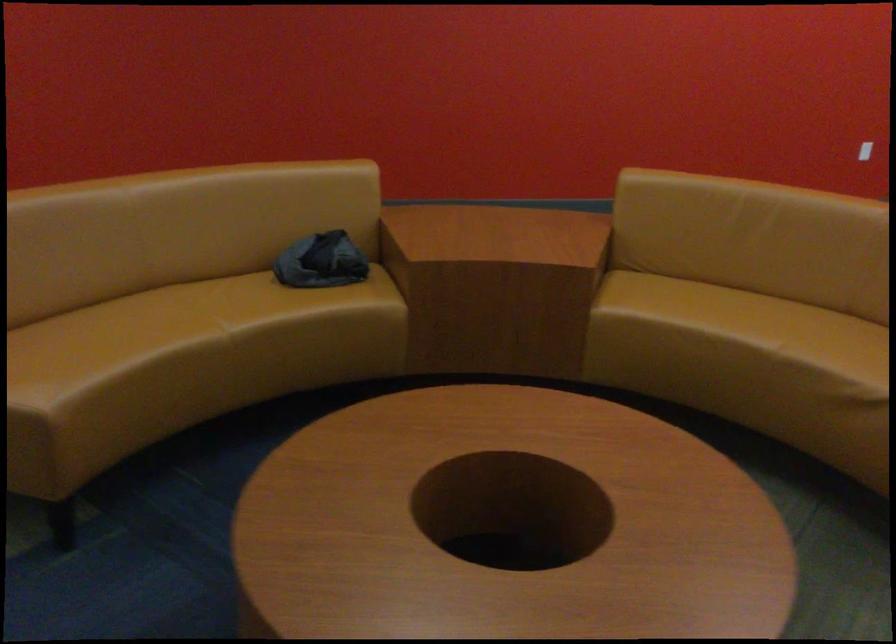
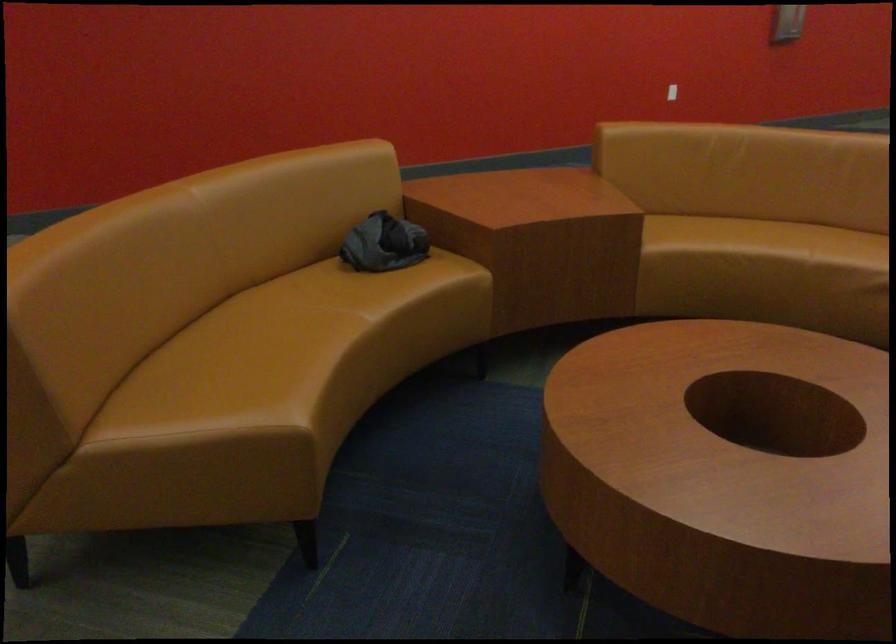
Locate, in the second image, the point that corresponds to point (142, 328) in the first image.

(271, 336)